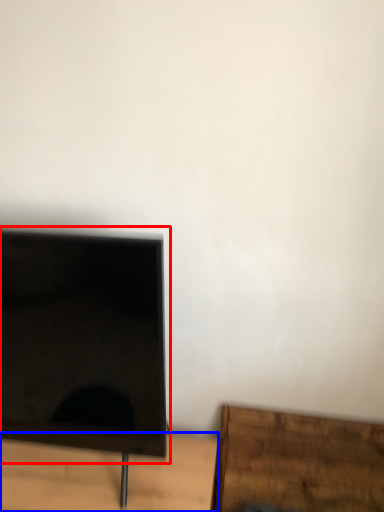
Question: Which object appears farthest to the camera in this image, computer monitor (highlighted by a red box) or table (highlighted by a blue box)?

Choices:
 (A) computer monitor
 (B) table

Answer: (B)